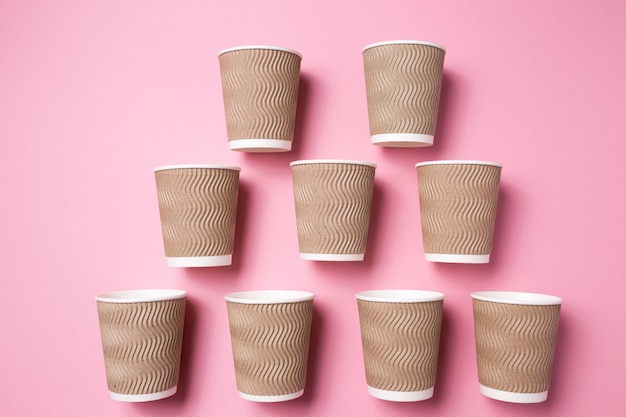
You are a GUI agent. You are given a task and a screenshot of the screen. Output one action in this format:
    pyautogui.click(x=<x>, y=<y>)
    Task: Click on the cups
    This screenshot has height=417, width=626.
    Given the screenshot: What is the action you would take?
    pyautogui.click(x=156, y=320), pyautogui.click(x=275, y=320), pyautogui.click(x=390, y=318), pyautogui.click(x=515, y=318), pyautogui.click(x=457, y=211), pyautogui.click(x=324, y=195), pyautogui.click(x=216, y=209), pyautogui.click(x=262, y=87), pyautogui.click(x=393, y=98)